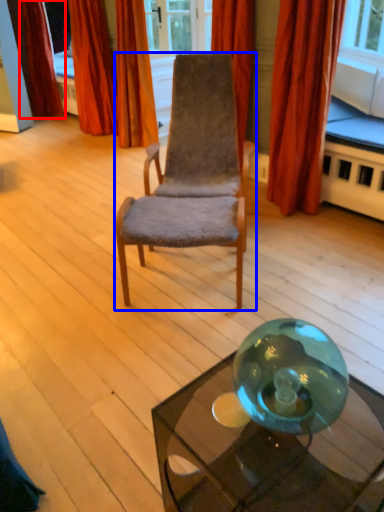
Question: Which of the following is the farthest to the observer, curtain (highlighted by a red box) or chair (highlighted by a blue box)?

Choices:
 (A) curtain
 (B) chair

Answer: (A)